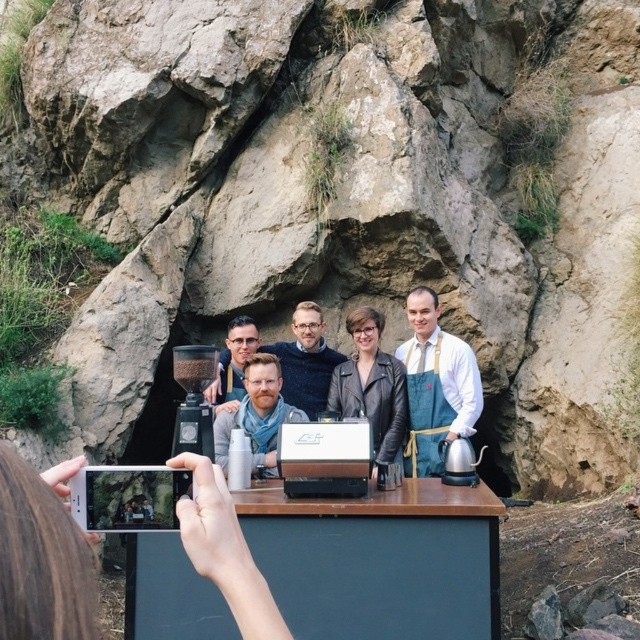
Which is behind, point (189, 454) or point (234, 387)?

The point (234, 387) is behind.

Does white matte phone at lower left have a lesser height compared to matte black shirt at center?

Indeed, white matte phone at lower left has a lesser height compared to matte black shirt at center.

Is point (3, 540) farther from viewer compared to point (230, 384)?

No, (3, 540) is closer to viewer.

What are the coordinates of `white matte phone at lower left` in the screenshot? It's located at (42, 554).

Between white matte phone at lower left and dark blue sweater at center, which one appears on the left side from the viewer's perspective?

dark blue sweater at center

Can you confirm if white matte phone at lower left is shorter than dark blue sweater at center?

Yes, white matte phone at lower left is shorter than dark blue sweater at center.

Is point (8, 577) farther from viewer compared to point (321, 349)?

That is False.

The width and height of the screenshot is (640, 640). I want to click on white matte phone at lower left, so click(42, 554).

Which is in front, point (49, 557) or point (408, 340)?

Point (49, 557)

Does white matte phone at lower left have a lesser height compared to blue apron at center?

Yes, white matte phone at lower left is shorter than blue apron at center.

Identify the location of white matte phone at lower left. (42, 554).